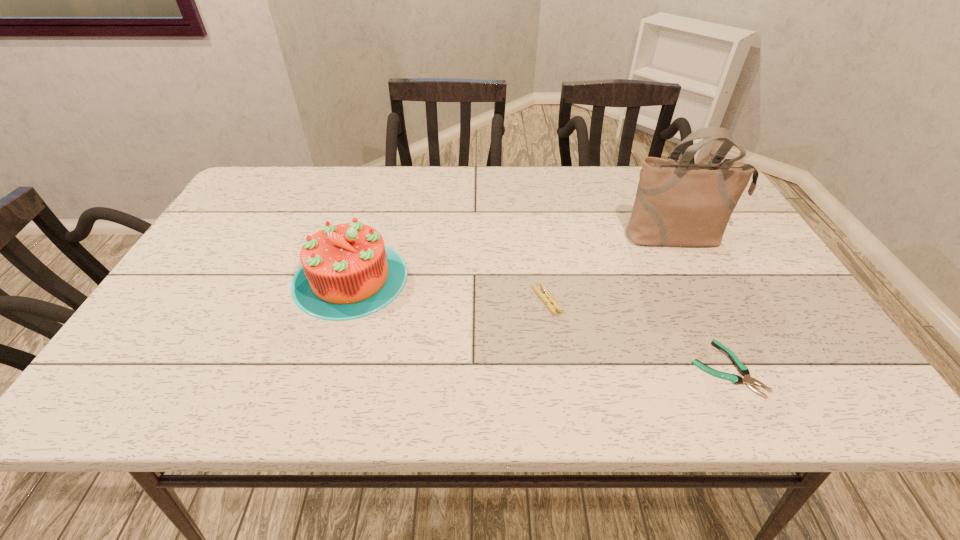
I want to click on the tallest object, so click(x=678, y=203).

Locate an element on the screen. This screenshot has width=960, height=540. cake is located at coordinates (347, 272).

Find the location of a particular element. The image size is (960, 540). the second tallest object is located at coordinates (347, 272).

Locate an element on the screen. Image resolution: width=960 pixels, height=540 pixels. the third object from right to left is located at coordinates (545, 296).

This screenshot has width=960, height=540. I want to click on clothespin, so click(545, 296).

The image size is (960, 540). I want to click on pliers, so click(743, 370).

The image size is (960, 540). What are the coordinates of `the shortest object` in the screenshot? It's located at (743, 370).

Find the location of a particular element. The width and height of the screenshot is (960, 540). vacant space located on the front-facing side of the tallest object is located at coordinates (731, 341).

At what (x,y) coordinates should I click in order to perform the action: click on vacant space located 0.080m on the front of the leftmost object. Please return your answer as a coordinate pair (x, y). Looking at the image, I should click on (328, 350).

Where is `free spot located on the front of the clothespin`? This screenshot has height=540, width=960. free spot located on the front of the clothespin is located at coordinates (552, 337).